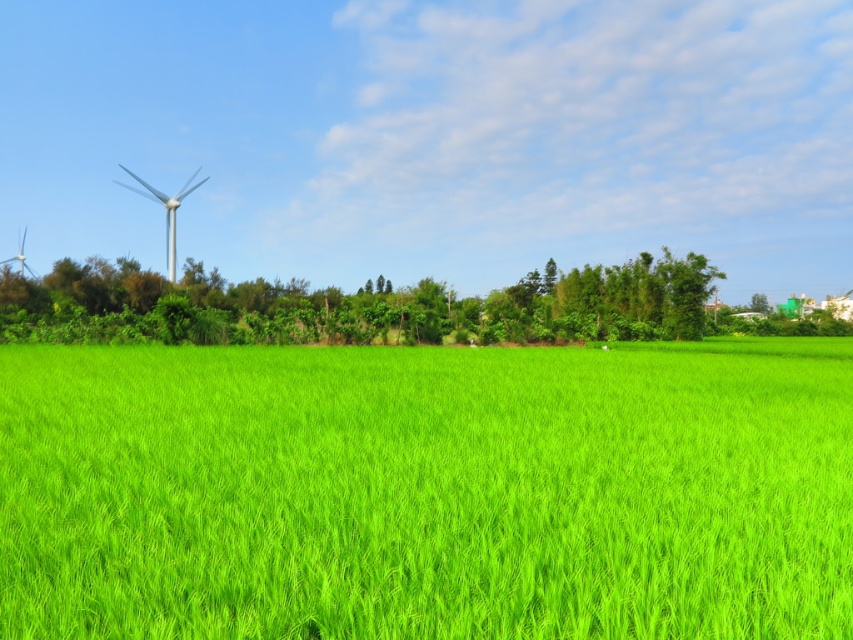
Question: Which of the following is the farthest from the observer?

Choices:
 (A) green grassy field at center
 (B) white matte wind turbine at upper left
 (C) green leafy tree at center

Answer: (B)

Question: Which of the following is the closest to the observer?

Choices:
 (A) (202, 179)
 (B) (402, 544)
 (C) (671, 260)

Answer: (B)

Question: Can you confirm if green grassy field at center is positioned to the right of white matte wind turbine at upper left?

Choices:
 (A) no
 (B) yes

Answer: (B)

Question: Can you confirm if green leafy tree at center is thinner than white matte wind turbine at upper left?

Choices:
 (A) yes
 (B) no

Answer: (B)

Question: Does green grassy field at center appear on the right side of green leafy tree at center?

Choices:
 (A) yes
 (B) no

Answer: (A)

Question: Which point is farther from the camera taking this photo?

Choices:
 (A) (431, 506)
 (B) (498, 326)

Answer: (B)